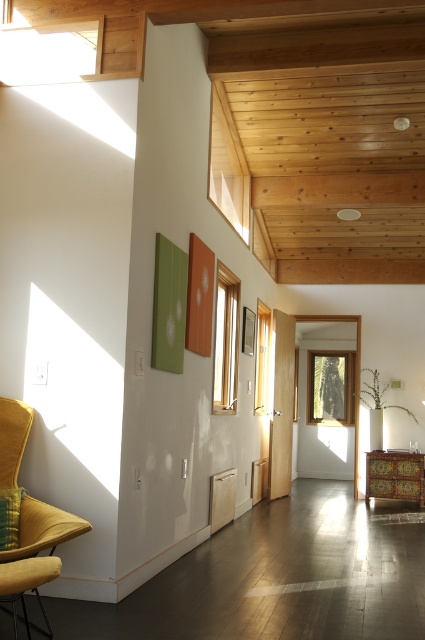
You are a delivery person trying to place a large package that is 6 meters long in this room. You need to position it between the velvet yellow armchair at left and the vividly painted wooden cabinet at center. Is there enough space between them to fit the package?

The velvet yellow armchair at left and the vividly painted wooden cabinet at center are 5.54 meters apart. Since the package is 6 meters long, it is longer than the available space between them. Therefore, the package cannot be placed between them.

You are planning to place a large potted plant between the velvet yellow armchair at left and the vividly painted wooden cabinet at center. Considering their sizes, which object should the plant be closer to?

The velvet yellow armchair at left is larger than the vividly painted wooden cabinet at center, so the plant should be placed closer to the velvet yellow armchair at left to maintain balance.

You are an interior designer planning to rearrange the furniture in the room. You want to place a new lamp on the shelf above the vividly painted wooden cabinet at center. However, you need to ensure that the shelf is not blocked by the velvet yellow pillow at left. Is the shelf above the cabinet accessible?

The vividly painted wooden cabinet at center is positioned under the velvet yellow pillow at left, meaning the shelf above the cabinet is blocked by the pillow. Therefore, the shelf is not accessible for placing the lamp.